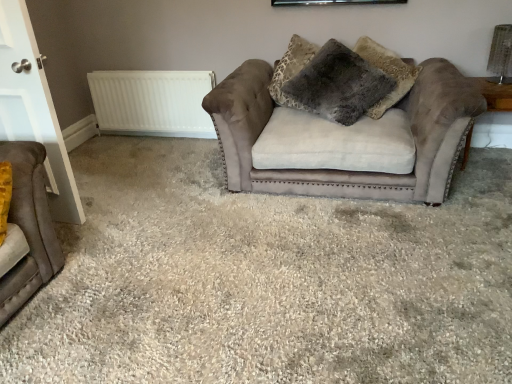
Locate an element on the screen. The width and height of the screenshot is (512, 384). free space in front of wooden side table at right is located at coordinates (487, 190).